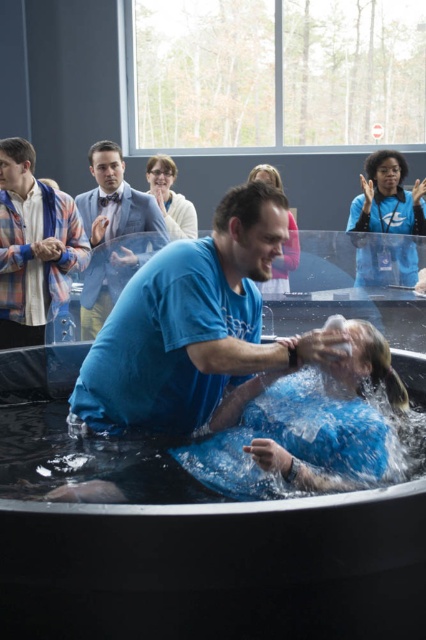
You are standing in the church and want to take a photo of the baptism. You notice the black rubber tub at center and the blue fabric suit at center. Which object should you focus on first to ensure it appears larger in your photo?

The black rubber tub at center is further to the viewer than the blue fabric suit at center, so focusing on the black rubber tub at center first will make it appear larger in the photo.

You are attending a baptism ceremony and notice the black rubber tub at center and the plaid shirt at left. From your perspective, which object is positioned lower in the image?

The black rubber tub at center is located below the plaid shirt at left, so it is positioned lower in the image.

Based on the photo, you are a photographer at the baptism ceremony. You need to capture a closeup of the blue fabric suit at center without the black rubber tub at center appearing in the shot. Is this possible given their positions?

The black rubber tub at center is positioned under the blue fabric suit at center, so it would be difficult to capture a closeup of the blue fabric suit at center without the black rubber tub at center appearing in the shot since it is directly beneath it.